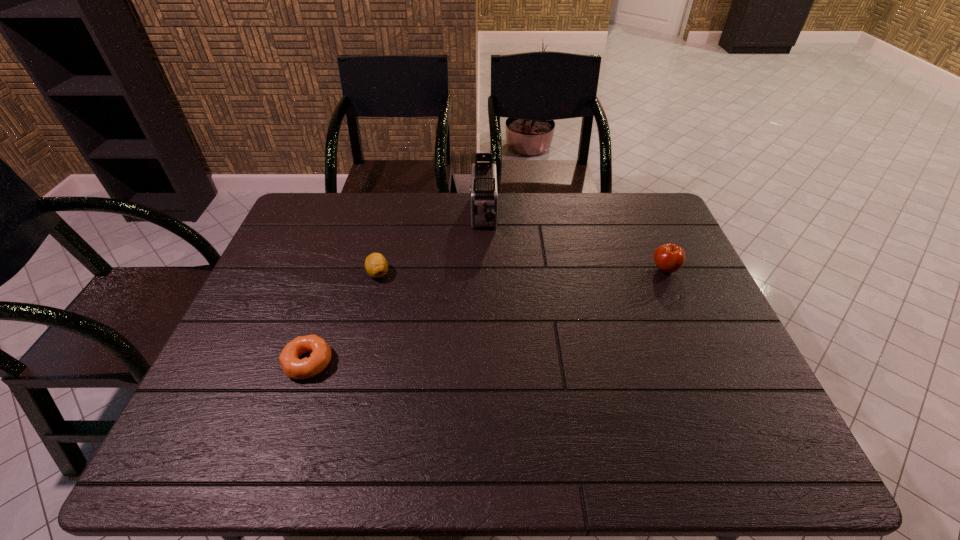
Where is `the farthest object`? This screenshot has height=540, width=960. the farthest object is located at coordinates (483, 191).

In order to click on the third object from left to right in this screenshot , I will do `click(483, 191)`.

Identify the location of the third shortest object. tap(669, 258).

I want to click on the rightmost object, so click(x=669, y=258).

The width and height of the screenshot is (960, 540). I want to click on the third tallest object, so click(x=376, y=265).

This screenshot has width=960, height=540. In order to click on the third object from right to left in this screenshot , I will do `click(376, 265)`.

Find the location of a particular element. The image size is (960, 540). the shortest object is located at coordinates (320, 356).

The width and height of the screenshot is (960, 540). I want to click on the leftmost object, so click(320, 356).

This screenshot has height=540, width=960. In order to click on free spot located at the lens of the third object from left to right in this screenshot , I will do `click(485, 331)`.

At what (x,y) coordinates should I click in order to perform the action: click on vacant space situated on the front of the apple. Please return your answer as a coordinate pair (x, y). This screenshot has width=960, height=540. Looking at the image, I should click on coord(687,319).